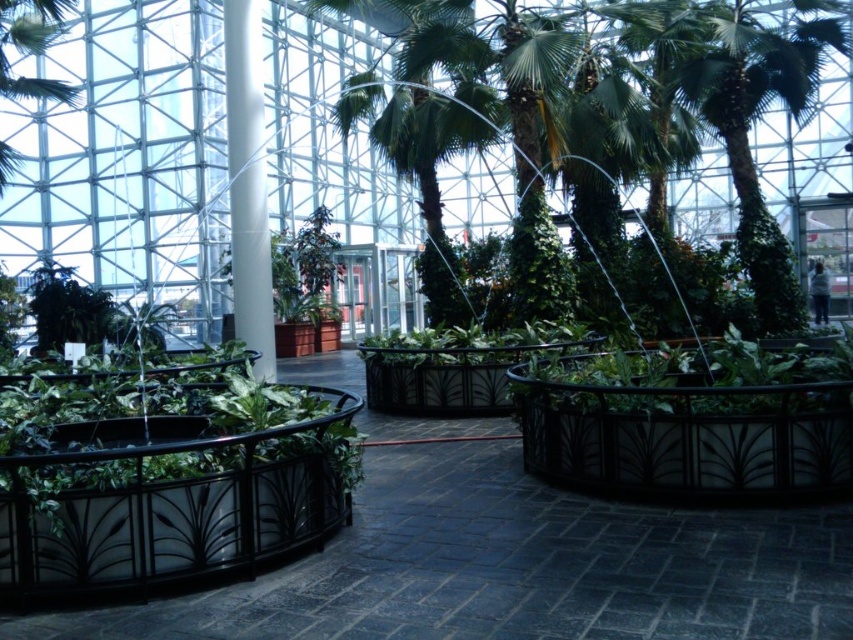
You are a gardener who needs to water both the green leafy palm tree at center and the green leafy palm tree at upper left. Starting from the entrance located at the lower right corner of the atrium, which palm tree should you approach first to reach the one on the left side first?

You should first approach the green leafy palm tree at upper left because it is located to the left of the green leafy palm tree at center, so reaching it first would allow you to efficiently move towards the left side.